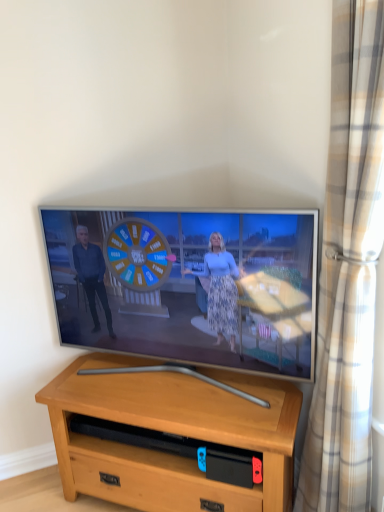
Question: In the image, is flat screen tv at center positioned in front of or behind light brown wood desk at center?

Choices:
 (A) front
 (B) behind

Answer: (A)

Question: In terms of size, does flat screen tv at center appear bigger or smaller than light brown wood desk at center?

Choices:
 (A) small
 (B) big

Answer: (A)

Question: Which object is positioned closest to the light brown wood desk at center?

Choices:
 (A) beige plaid curtain at right
 (B) flat screen tv at center

Answer: (B)

Question: Which is nearer to the flat screen tv at center?

Choices:
 (A) beige plaid curtain at right
 (B) light brown wood desk at center

Answer: (B)